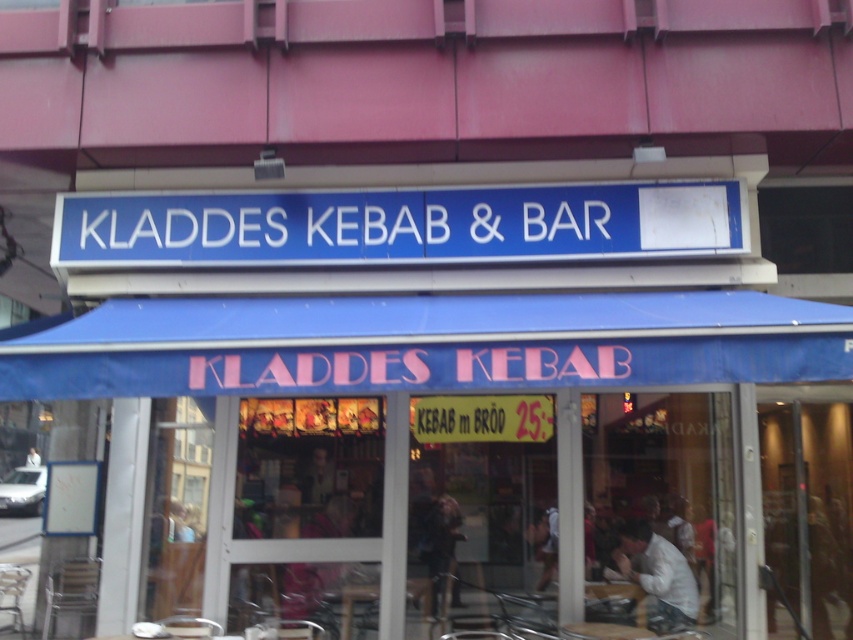
Question: Does blue fabric canopy at center have a smaller size compared to blue plastic sign at center?

Choices:
 (A) yes
 (B) no

Answer: (B)

Question: Is blue fabric canopy at center below blue plastic sign at center?

Choices:
 (A) no
 (B) yes

Answer: (B)

Question: Which point is closer to the camera?

Choices:
 (A) (482, 202)
 (B) (264, 356)

Answer: (B)

Question: Where is blue fabric canopy at center located in relation to blue plastic sign at center in the image?

Choices:
 (A) right
 (B) left

Answer: (A)

Question: Among these objects, which one is nearest to the camera?

Choices:
 (A) blue plastic sign at center
 (B) blue fabric canopy at center

Answer: (B)